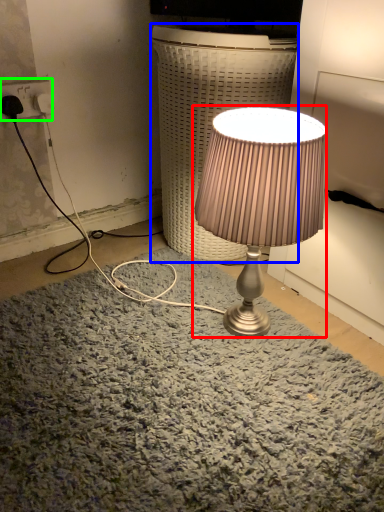
Question: Based on their relative distances, which object is farther from lamp (highlighted by a red box)? Choose from table (highlighted by a blue box) and electric outlet (highlighted by a green box).

Choices:
 (A) table
 (B) electric outlet

Answer: (B)